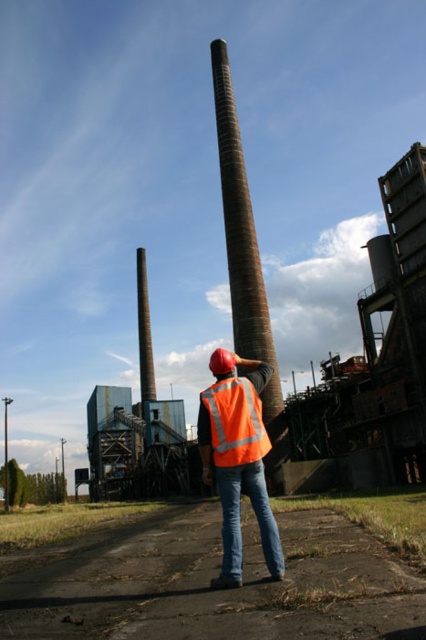
You are a safety inspector checking the visibility of the worker in the image. You need to determine if the orange reflective safety vest at center is visible above the jeans at center. Based on the scene description, can you confirm if the vest is visible above the jeans?

The jeans at center has a greater height compared to orange reflective safety vest at center, so the vest is not visible above the jeans.

You are a safety inspector standing in the industrial area shown. You need to check the stability of the partially constructed building to the right. Your jeans at center are currently at a specific coordinate. What coordinate should you move to in order to safely approach the partially constructed building?

The jeans at center are at coordinate point (219, 592). To safely approach the partially constructed building to the right, you should move towards coordinates that are closer to the building, which would be higher in the x or y direction depending on the coordinate system used in the image.